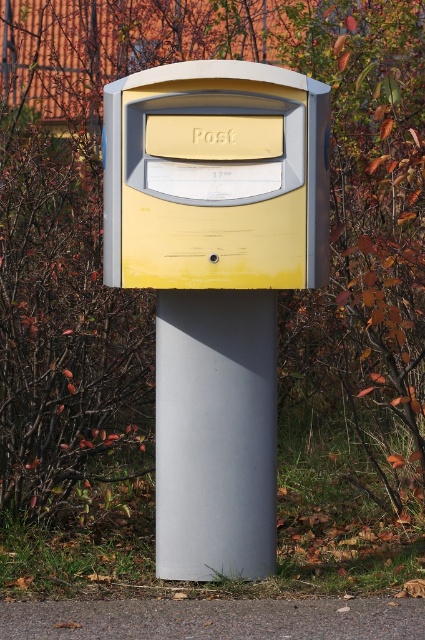
Can you confirm if yellow matte mailbox at center is taller than matte gray pole at center?

In fact, yellow matte mailbox at center may be shorter than matte gray pole at center.

This screenshot has height=640, width=425. What are the coordinates of `yellow matte mailbox at center` in the screenshot? It's located at (215, 177).